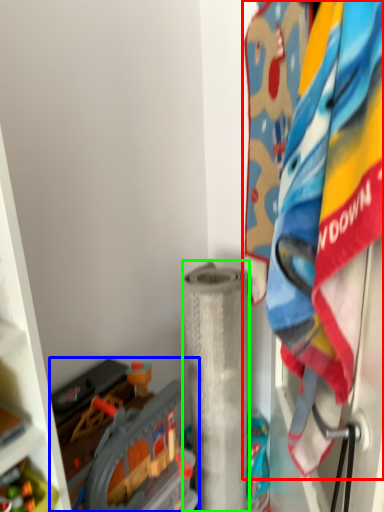
Question: Considering the real-world distances, which object is closest to laundry (highlighted by a red box)? toy (highlighted by a blue box) or toilet paper (highlighted by a green box).

Choices:
 (A) toy
 (B) toilet paper

Answer: (A)